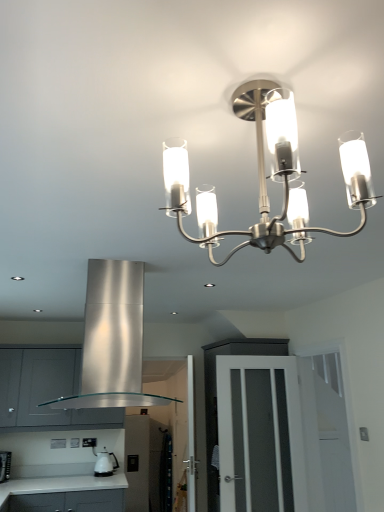
Image resolution: width=384 pixels, height=512 pixels. What do you see at coordinates (266, 176) in the screenshot? I see `satin nickel chandelier at upper center` at bounding box center [266, 176].

What do you see at coordinates (64, 494) in the screenshot? I see `white laminate countertop at lower left` at bounding box center [64, 494].

Where is `white laminate countertop at lower left`? white laminate countertop at lower left is located at coordinates (64, 494).

Locate an element on the screen. The width and height of the screenshot is (384, 512). white glossy kettle at lower left is located at coordinates (105, 463).

Image resolution: width=384 pixels, height=512 pixels. What do you see at coordinates (112, 340) in the screenshot? I see `stainless steel exhaust hood at center` at bounding box center [112, 340].

Measure the distance between point (x=110, y=362) and camera.

Point (x=110, y=362) is 7.33 feet from camera.

Find the location of a particular element. The image size is (384, 512). satin nickel chandelier at upper center is located at coordinates (266, 176).

Between satin silver cabinet at lower left and white glossy kettle at lower left, which one has larger width?

satin silver cabinet at lower left.

Is point (22, 408) positioned in front of point (108, 473)?

Yes, point (22, 408) is closer to viewer.

Which is more to the left, satin silver cabinet at lower left or white glossy kettle at lower left?

satin silver cabinet at lower left.

How different are the orientations of satin silver cabinet at lower left and white glossy kettle at lower left in degrees?

The angular difference between satin silver cabinet at lower left and white glossy kettle at lower left is 0.00109 degrees.

From the image's perspective, is clear glass door at center located above or below stainless steel exhaust hood at center?

clear glass door at center is below stainless steel exhaust hood at center.

In order to click on glass door lying behind the stainless steel exhaust hood at center in this screenshot , I will do `click(260, 434)`.

Does clear glass door at center appear on the right side of stainless steel exhaust hood at center?

Yes, clear glass door at center is to the right of stainless steel exhaust hood at center.

Would you say stainless steel exhaust hood at center is part of satin nickel chandelier at upper center's contents?

Actually, stainless steel exhaust hood at center is outside satin nickel chandelier at upper center.

Are satin nickel chandelier at upper center and stainless steel exhaust hood at center far apart?

Yes, satin nickel chandelier at upper center and stainless steel exhaust hood at center are located far from each other.

Can you confirm if satin nickel chandelier at upper center is shorter than stainless steel exhaust hood at center?

Correct, satin nickel chandelier at upper center is not as tall as stainless steel exhaust hood at center.

Is satin silver cabinet at lower left inside the boundaries of stainless steel exhaust hood at center, or outside?

satin silver cabinet at lower left is not enclosed by stainless steel exhaust hood at center.

Does satin silver cabinet at lower left have a lesser height compared to stainless steel exhaust hood at center?

No, satin silver cabinet at lower left is not shorter than stainless steel exhaust hood at center.

From a real-world perspective, who is located higher, satin silver cabinet at lower left or stainless steel exhaust hood at center?

In real-world perspective, stainless steel exhaust hood at center is above.

Can you see satin silver cabinet at lower left touching stainless steel exhaust hood at center?

There is a gap between satin silver cabinet at lower left and stainless steel exhaust hood at center.

Considering the relative positions of white glossy kettle at lower left and satin nickel chandelier at upper center in the image provided, is white glossy kettle at lower left to the right of satin nickel chandelier at upper center from the viewer's perspective?

No, white glossy kettle at lower left is not to the right of satin nickel chandelier at upper center.

From a real-world perspective, is white glossy kettle at lower left on top of satin nickel chandelier at upper center?

No, from a real-world perspective, white glossy kettle at lower left is not on top of satin nickel chandelier at upper center.

Can you confirm if white glossy kettle at lower left is shorter than satin nickel chandelier at upper center?

Yes.

Is white glossy kettle at lower left positioned with its back to satin nickel chandelier at upper center?

white glossy kettle at lower left does not have its back to satin nickel chandelier at upper center.

What's the angular difference between white glossy kettle at lower left and white laminate countertop at lower left's facing directions?

0.000498 degrees.

Is point (113, 453) farther from camera compared to point (50, 493)?

Yes, it is behind point (50, 493).

Considering the positions of objects white glossy kettle at lower left and white laminate countertop at lower left in the image provided, who is more to the left, white glossy kettle at lower left or white laminate countertop at lower left?

Positioned to the left is white laminate countertop at lower left.

Is white glossy kettle at lower left oriented away from white laminate countertop at lower left?

white glossy kettle at lower left is not turned away from white laminate countertop at lower left.

From the image's perspective, between white laminate countertop at lower left and white glossy kettle at lower left, who is located below?

From the image's view, white laminate countertop at lower left is below.

How far apart are white laminate countertop at lower left and white glossy kettle at lower left?

white laminate countertop at lower left is 36.02 centimeters from white glossy kettle at lower left.

You are a GUI agent. You are given a task and a screenshot of the screen. Output one action in this format:
    pyautogui.click(x=<x>, y=<y>)
    Task: Click on the countertop below the white glossy kettle at lower left (from a real-world perspective)
    
    Given the screenshot: What is the action you would take?
    pyautogui.click(x=64, y=494)

Which object is positioned more to the right, white laminate countertop at lower left or white glossy kettle at lower left?

From the viewer's perspective, white glossy kettle at lower left appears more on the right side.

Locate an element on the screen. appliance that is below the satin silver cabinet at lower left (from the image's perspective) is located at coordinates (105, 463).

The image size is (384, 512). I want to click on exhaust hood that appears above the clear glass door at center (from the image's perspective), so click(x=112, y=340).

When comparing their distances from satin silver cabinet at lower left, does white glossy kettle at lower left or clear glass door at center seem further?

clear glass door at center is positioned further to the anchor satin silver cabinet at lower left.

Which object lies nearer to the anchor point white laminate countertop at lower left, stainless steel exhaust hood at center or clear glass door at center?

The object closer to white laminate countertop at lower left is clear glass door at center.

Based on their spatial positions, is white laminate countertop at lower left or satin silver cabinet at lower left further from white glossy kettle at lower left?

satin silver cabinet at lower left is further to white glossy kettle at lower left.

Considering their positions, is white glossy kettle at lower left positioned further to stainless steel exhaust hood at center than white laminate countertop at lower left?

white glossy kettle at lower left is positioned further to the anchor stainless steel exhaust hood at center.

Looking at the image, which one is located further to satin nickel chandelier at upper center, satin silver cabinet at lower left or stainless steel exhaust hood at center?

The object further to satin nickel chandelier at upper center is satin silver cabinet at lower left.

In the scene shown: Based on their spatial positions, is white laminate countertop at lower left or white glossy kettle at lower left closer to stainless steel exhaust hood at center?

white laminate countertop at lower left.

Estimate the real-world distances between objects in this image. Which object is closer to white glossy kettle at lower left, clear glass door at center or satin nickel chandelier at upper center?

clear glass door at center.

Considering their positions, is white laminate countertop at lower left positioned closer to satin nickel chandelier at upper center than white glossy kettle at lower left?

The object closer to satin nickel chandelier at upper center is white laminate countertop at lower left.

The image size is (384, 512). Identify the location of countertop between satin silver cabinet at lower left and clear glass door at center. (64, 494).

Image resolution: width=384 pixels, height=512 pixels. Find the location of `exhaust hood located between satin nickel chandelier at upper center and white glossy kettle at lower left in the depth direction`. exhaust hood located between satin nickel chandelier at upper center and white glossy kettle at lower left in the depth direction is located at coordinates (112, 340).

You are a GUI agent. You are given a task and a screenshot of the screen. Output one action in this format:
    pyautogui.click(x=<x>, y=<y>)
    Task: Click on the appliance located between satin silver cabinet at lower left and clear glass door at center in the left-right direction
    
    Given the screenshot: What is the action you would take?
    pyautogui.click(x=105, y=463)

Where is `exhaust hood positioned between satin nickel chandelier at upper center and satin silver cabinet at lower left from near to far`? exhaust hood positioned between satin nickel chandelier at upper center and satin silver cabinet at lower left from near to far is located at coordinates (112, 340).